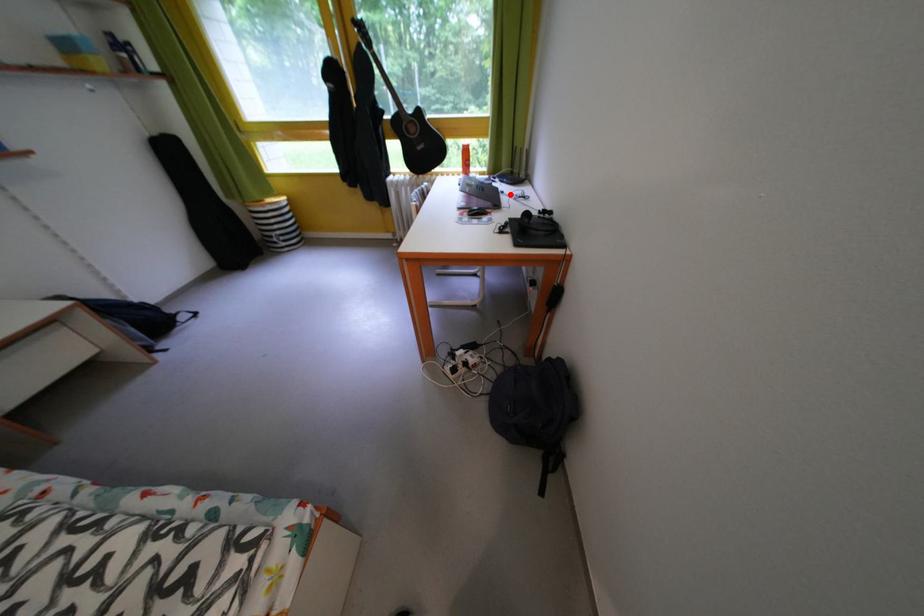
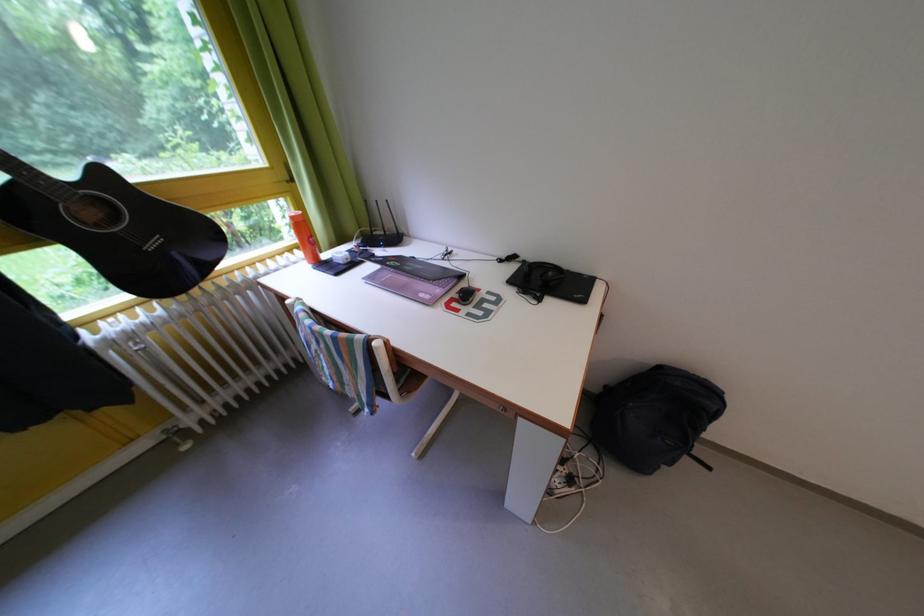
Question: A red point is marked in image1. In image2, is the corresponding 3D point closer to the camera or farther? Reply with the corresponding letter.

Choices:
 (A) The corresponding 3D point is closer.
 (B) The corresponding 3D point is farther.

Answer: (B)